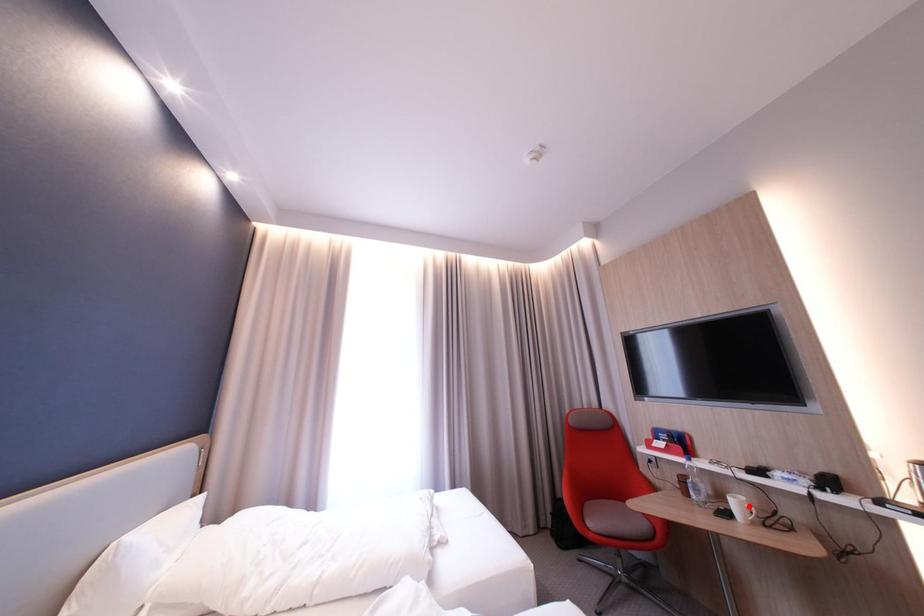
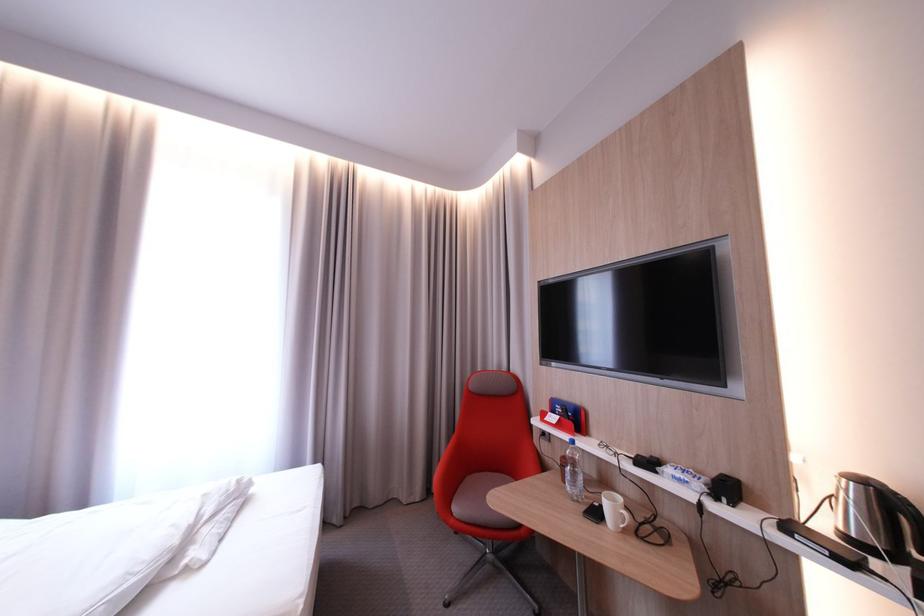
In the second image, find the point that corresponds to the highlighted location in the first image.

(623, 508)